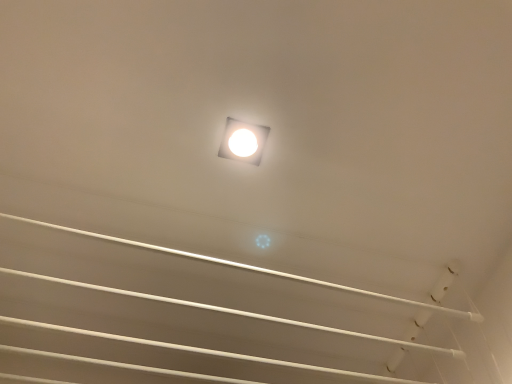
Question: Does white glossy square at center appear on the right side of white glossy ceiling at upper center?

Choices:
 (A) yes
 (B) no

Answer: (A)

Question: Considering the relative sizes of white glossy square at center and white glossy ceiling at upper center in the image provided, is white glossy square at center shorter than white glossy ceiling at upper center?

Choices:
 (A) yes
 (B) no

Answer: (A)

Question: Is white glossy square at center at the left side of white glossy ceiling at upper center?

Choices:
 (A) yes
 (B) no

Answer: (B)

Question: From a real-world perspective, is white glossy square at center beneath white glossy ceiling at upper center?

Choices:
 (A) no
 (B) yes

Answer: (A)

Question: Is white glossy square at center smaller than white glossy ceiling at upper center?

Choices:
 (A) no
 (B) yes

Answer: (B)

Question: Can you confirm if white glossy square at center is thinner than white glossy ceiling at upper center?

Choices:
 (A) yes
 (B) no

Answer: (A)

Question: Does white glossy ceiling at upper center turn towards white glossy square at center?

Choices:
 (A) no
 (B) yes

Answer: (B)

Question: Is white glossy ceiling at upper center facing away from white glossy square at center?

Choices:
 (A) no
 (B) yes

Answer: (A)

Question: Can you confirm if white glossy ceiling at upper center is positioned to the right of white glossy square at center?

Choices:
 (A) no
 (B) yes

Answer: (A)

Question: Is white glossy ceiling at upper center closer to camera compared to white glossy square at center?

Choices:
 (A) no
 (B) yes

Answer: (B)

Question: Can you confirm if white glossy ceiling at upper center is thinner than white glossy square at center?

Choices:
 (A) no
 (B) yes

Answer: (A)

Question: Is the depth of white glossy ceiling at upper center greater than that of white glossy square at center?

Choices:
 (A) no
 (B) yes

Answer: (A)

Question: From their relative heights in the image, would you say white glossy square at center is taller or shorter than white glossy ceiling at upper center?

Choices:
 (A) tall
 (B) short

Answer: (B)